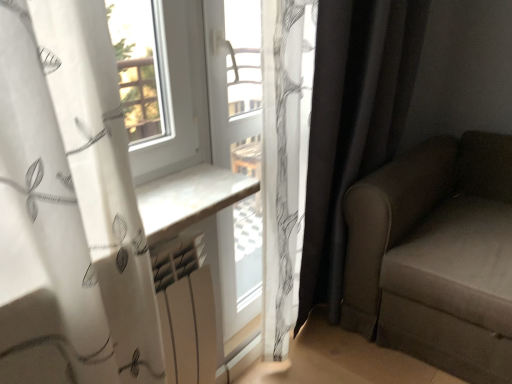
Question: Is white plastic window frame at center bigger than black fabric curtain at right?

Choices:
 (A) yes
 (B) no

Answer: (B)

Question: Can you confirm if white plastic window frame at center is thinner than black fabric curtain at right?

Choices:
 (A) no
 (B) yes

Answer: (B)

Question: Is black fabric curtain at right inside white plastic window frame at center?

Choices:
 (A) no
 (B) yes

Answer: (A)

Question: Does white plastic window frame at center come behind black fabric curtain at right?

Choices:
 (A) no
 (B) yes

Answer: (B)

Question: From a real-world perspective, is white plastic window frame at center beneath black fabric curtain at right?

Choices:
 (A) no
 (B) yes

Answer: (A)

Question: From the image's perspective, is white matte radiator at center located above or below black fabric curtain at right?

Choices:
 (A) above
 (B) below

Answer: (B)

Question: Would you say white matte radiator at center is to the left or to the right of black fabric curtain at right in the picture?

Choices:
 (A) left
 (B) right

Answer: (A)

Question: From a real-world perspective, is white matte radiator at center positioned above or below black fabric curtain at right?

Choices:
 (A) below
 (B) above

Answer: (A)

Question: Is white matte radiator at center inside or outside of black fabric curtain at right?

Choices:
 (A) outside
 (B) inside

Answer: (A)

Question: From a real-world perspective, is black fabric curtain at right above or below white matte radiator at center?

Choices:
 (A) below
 (B) above

Answer: (B)

Question: Is black fabric curtain at right to the left or to the right of white matte radiator at center in the image?

Choices:
 (A) right
 (B) left

Answer: (A)

Question: Relative to white matte radiator at center, is black fabric curtain at right in front or behind?

Choices:
 (A) front
 (B) behind

Answer: (B)

Question: Considering the positions of black fabric curtain at right and white matte radiator at center in the image, is black fabric curtain at right wider or thinner than white matte radiator at center?

Choices:
 (A) wide
 (B) thin

Answer: (A)

Question: Visually, is black fabric curtain at right positioned to the left or to the right of suede-like brown couch at right?

Choices:
 (A) right
 (B) left

Answer: (B)

Question: Considering the positions of black fabric curtain at right and suede-like brown couch at right in the image, is black fabric curtain at right wider or thinner than suede-like brown couch at right?

Choices:
 (A) thin
 (B) wide

Answer: (A)